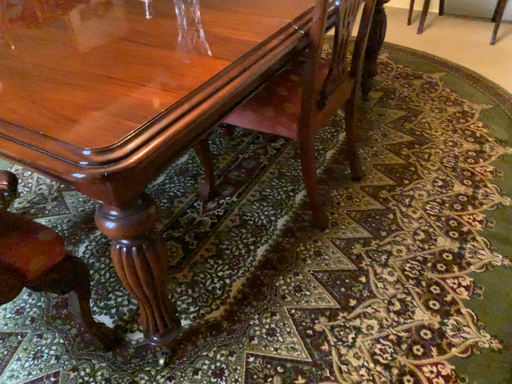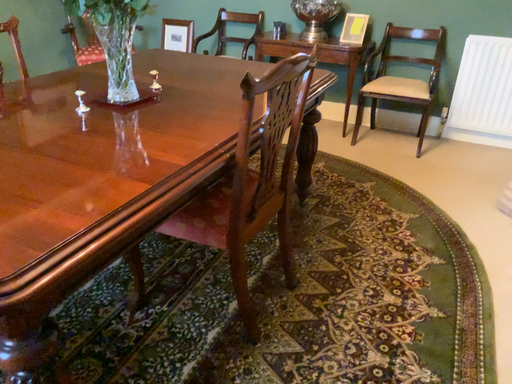
Question: How did the camera likely rotate when shooting the video?

Choices:
 (A) rotated upward
 (B) rotated downward

Answer: (A)